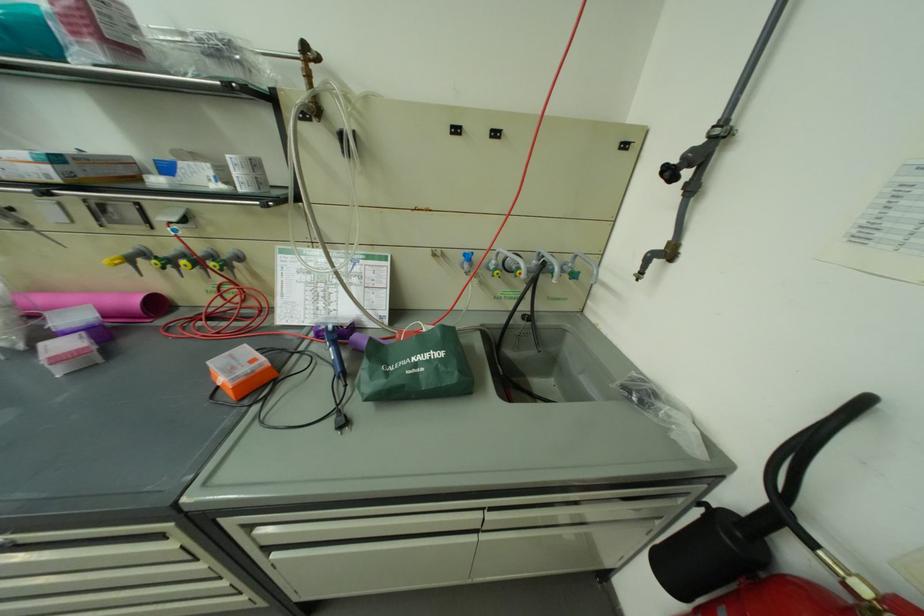
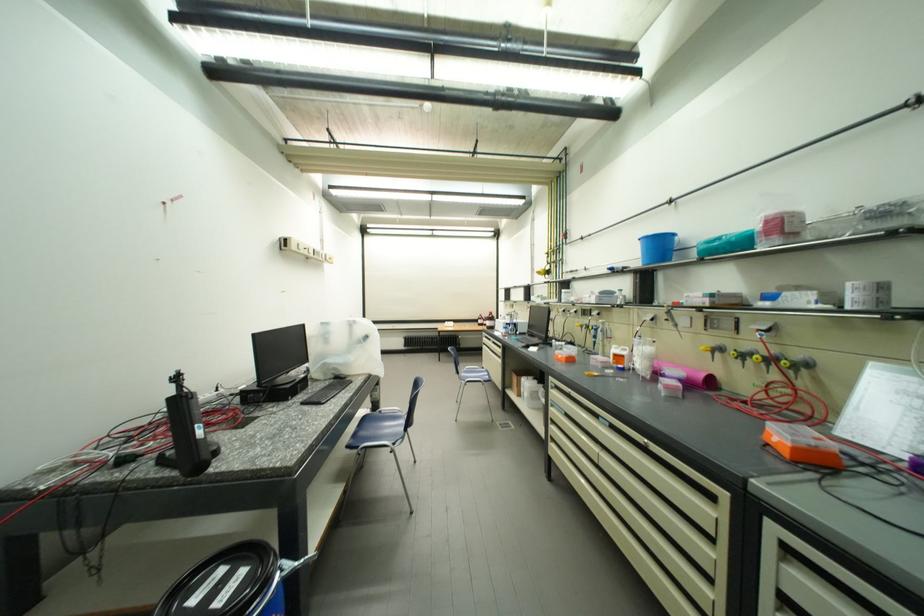
Find the pixel in the second image that matches the point at 257,376 in the first image.

(820, 447)